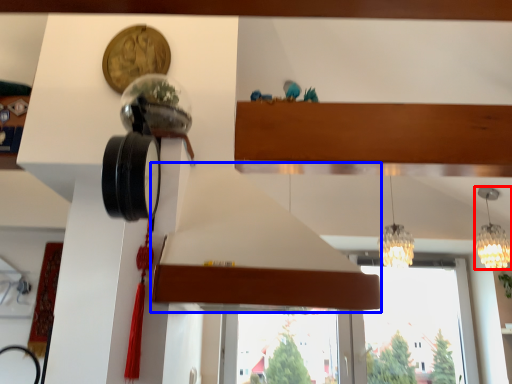
Question: Among these objects, which one is farthest to the camera, lamp (highlighted by a red box) or exhaust hood (highlighted by a blue box)?

Choices:
 (A) lamp
 (B) exhaust hood

Answer: (A)